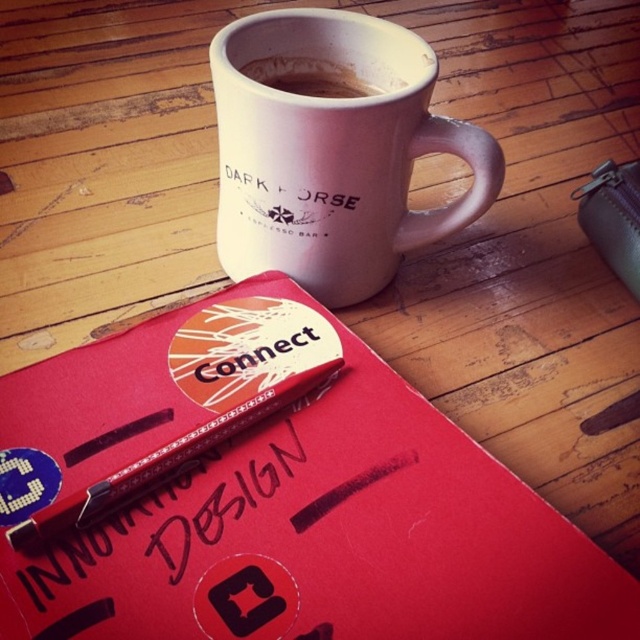
You are an artist who needs to sign a contract. You have a metallic silver pen at center and a dark matte coffee cup at upper center on your desk. Which object should you reach for first to sign the contract without spilling the coffee?

You should reach for the metallic silver pen at center first because it is closer to you than the dark matte coffee cup at upper center, reducing the risk of accidentally knocking over the cup.

You are an office worker who needs to reach for the black pen at center to sign a document. However, you are currently holding the white matte mug at upper center. Can you reach the pen without spilling the hot coffee in the mug?

The white matte mug at upper center is 12.99 inches away from the black pen at center. Since this distance is relatively short, you can carefully extend your arm to reach the black pen at center without spilling the coffee, provided you move slowly and steadily.

Consider the image. You are an office worker who just arrived at your desk. You see the red matte notebook at upper center and the dark matte coffee cup at upper center. Which object is closer to your left side?

The red matte notebook at upper center is to the left of the dark matte coffee cup at upper center, so it is closer to your left side.